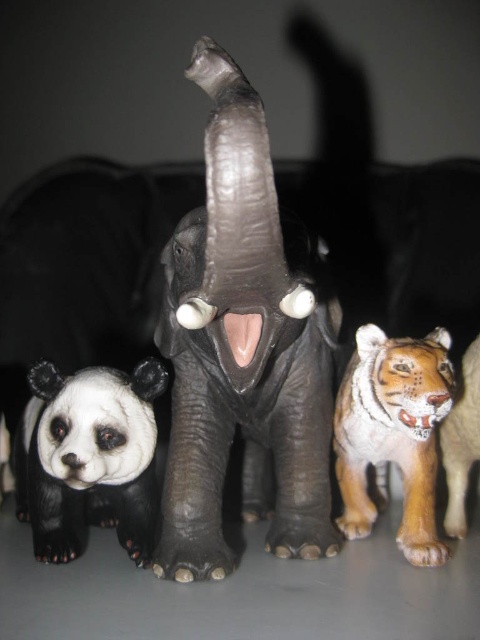
Question: Does black matte/painted panda at center-left appear over black and white plush panda at lower left?

Choices:
 (A) yes
 (B) no

Answer: (A)

Question: Does black matte/painted panda at center-left have a greater width compared to orange-brown fur tiger at right?

Choices:
 (A) yes
 (B) no

Answer: (A)

Question: Which point is farther from the camera taking this photo?

Choices:
 (A) (55, 518)
 (B) (279, 428)

Answer: (B)

Question: In this image, where is black and white plush panda at lower left located relative to orange-brown fur tiger at right?

Choices:
 (A) right
 (B) left

Answer: (B)

Question: Which point is closer to the camera?

Choices:
 (A) black matte/painted panda at center-left
 (B) black and white plush panda at lower left

Answer: (A)

Question: Which of the following is the farthest from the observer?

Choices:
 (A) (301, 528)
 (B) (375, 440)

Answer: (B)